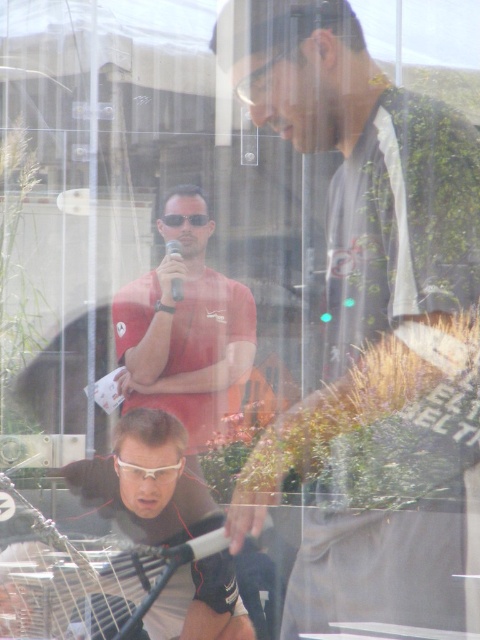
Can you confirm if white plastic goggles at lower center is smaller than matte black goggles at center?

Incorrect, white plastic goggles at lower center is not smaller in size than matte black goggles at center.

Image resolution: width=480 pixels, height=640 pixels. What do you see at coordinates (147, 470) in the screenshot?
I see `white plastic goggles at lower center` at bounding box center [147, 470].

Measure the distance between white plastic goggles at lower center and camera.

A distance of 2.18 meters exists between white plastic goggles at lower center and camera.

Find the location of `white plastic goggles at lower center`. white plastic goggles at lower center is located at coordinates (147, 470).

Is matte red shirt at center to the left of matte black goggles at center from the viewer's perspective?

Correct, you'll find matte red shirt at center to the left of matte black goggles at center.

Is point (208, 296) positioned before point (195, 225)?

No, (208, 296) is behind (195, 225).

This screenshot has height=640, width=480. I want to click on matte red shirt at center, so click(183, 337).

Measure the distance between matte red shirt at center and white plastic goggles at lower center.

matte red shirt at center is 5.95 inches away from white plastic goggles at lower center.

Consider the image. Can you confirm if matte red shirt at center is positioned to the right of white plastic goggles at lower center?

Indeed, matte red shirt at center is positioned on the right side of white plastic goggles at lower center.

Which is in front, point (159, 333) or point (159, 476)?

Point (159, 476) is more forward.

The height and width of the screenshot is (640, 480). Find the location of `matte red shirt at center`. matte red shirt at center is located at coordinates (183, 337).